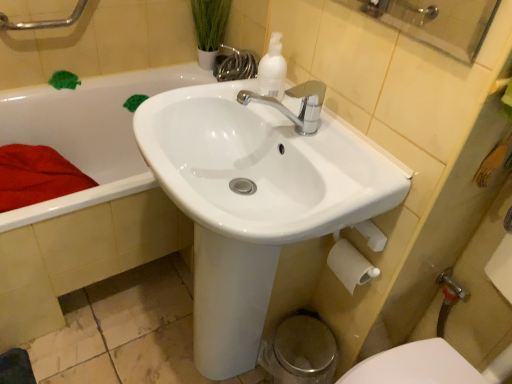
Question: Does brushed metal grab bar at upper left have a lesser height compared to white matte toilet paper at lower right?

Choices:
 (A) yes
 (B) no

Answer: (B)

Question: Does brushed metal grab bar at upper left lie behind white matte toilet paper at lower right?

Choices:
 (A) no
 (B) yes

Answer: (B)

Question: Considering the relative sizes of brushed metal grab bar at upper left and white matte toilet paper at lower right in the image provided, is brushed metal grab bar at upper left bigger than white matte toilet paper at lower right?

Choices:
 (A) no
 (B) yes

Answer: (B)

Question: From the image's perspective, is brushed metal grab bar at upper left above white matte toilet paper at lower right?

Choices:
 (A) yes
 (B) no

Answer: (A)

Question: Does brushed metal grab bar at upper left turn towards white matte toilet paper at lower right?

Choices:
 (A) no
 (B) yes

Answer: (B)

Question: From the image's perspective, is metallic silver faucet at lower right positioned above or below green leafy plant at upper center?

Choices:
 (A) above
 (B) below

Answer: (B)

Question: Which is correct: metallic silver faucet at lower right is inside green leafy plant at upper center, or outside of it?

Choices:
 (A) outside
 (B) inside

Answer: (A)

Question: From a real-world perspective, is metallic silver faucet at lower right positioned above or below green leafy plant at upper center?

Choices:
 (A) below
 (B) above

Answer: (A)

Question: Based on their positions, is metallic silver faucet at lower right located to the left or right of green leafy plant at upper center?

Choices:
 (A) right
 (B) left

Answer: (A)

Question: In terms of width, does white matte pump bottle at upper center look wider or thinner when compared to white glossy sink at center?

Choices:
 (A) thin
 (B) wide

Answer: (A)

Question: Is white matte pump bottle at upper center situated inside white glossy sink at center or outside?

Choices:
 (A) outside
 (B) inside

Answer: (A)

Question: From a real-world perspective, is white matte pump bottle at upper center above or below white glossy sink at center?

Choices:
 (A) below
 (B) above

Answer: (B)

Question: Is white matte pump bottle at upper center bigger or smaller than white glossy sink at center?

Choices:
 (A) big
 (B) small

Answer: (B)

Question: In terms of height, does brushed metal grab bar at upper left look taller or shorter compared to white glossy sink at center?

Choices:
 (A) short
 (B) tall

Answer: (A)

Question: From a real-world perspective, relative to white glossy sink at center, is brushed metal grab bar at upper left vertically above or below?

Choices:
 (A) above
 (B) below

Answer: (A)